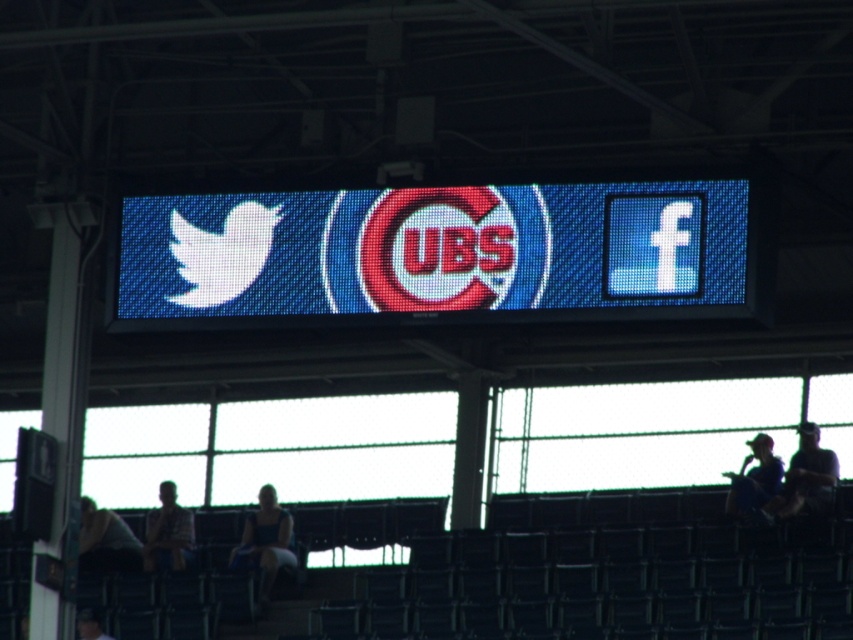
Who is more distant from viewer, (804, 428) or (132, 554)?

The point (132, 554) is behind.

The height and width of the screenshot is (640, 853). I want to click on dark blue shirt at right, so [x=808, y=476].

This screenshot has width=853, height=640. Identify the location of dark blue shirt at right. (808, 476).

Is point (251, 547) farther from camera compared to point (149, 516)?

No, it is in front of (149, 516).

Is blue denim dress at lower center to the left of plaid shirt at lower left from the viewer's perspective?

In fact, blue denim dress at lower center is to the right of plaid shirt at lower left.

Which is in front, point (280, 515) or point (173, 484)?

Point (280, 515)

Where is `blue denim dress at lower center`? Image resolution: width=853 pixels, height=640 pixels. blue denim dress at lower center is located at coordinates (265, 541).

Between point (263, 323) and point (741, 500), which one is positioned in front?

Positioned in front is point (263, 323).

Where is `matte digital display at center`? This screenshot has height=640, width=853. matte digital display at center is located at coordinates (434, 253).